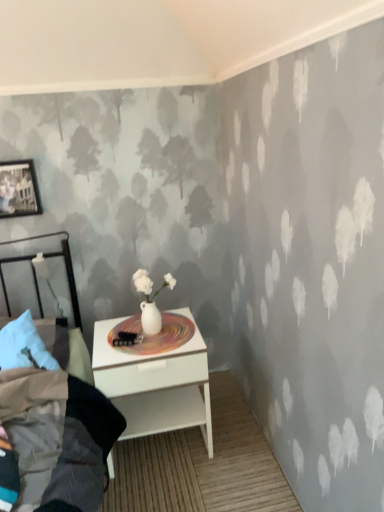
Question: From a real-world perspective, is white glossy nightstand at lower center physically located above or below white glossy vase at center?

Choices:
 (A) above
 (B) below

Answer: (B)

Question: Considering the relative positions of white glossy nightstand at lower center and white glossy vase at center in the image provided, is white glossy nightstand at lower center to the left or to the right of white glossy vase at center?

Choices:
 (A) left
 (B) right

Answer: (A)

Question: Estimate the real-world distances between objects in this image. Which object is farther from the white glossy nightstand at lower center?

Choices:
 (A) white glossy vase at center
 (B) matte black picture frame at upper left

Answer: (B)

Question: Which object is positioned closest to the matte black picture frame at upper left?

Choices:
 (A) white glossy vase at center
 (B) white glossy nightstand at lower center

Answer: (A)